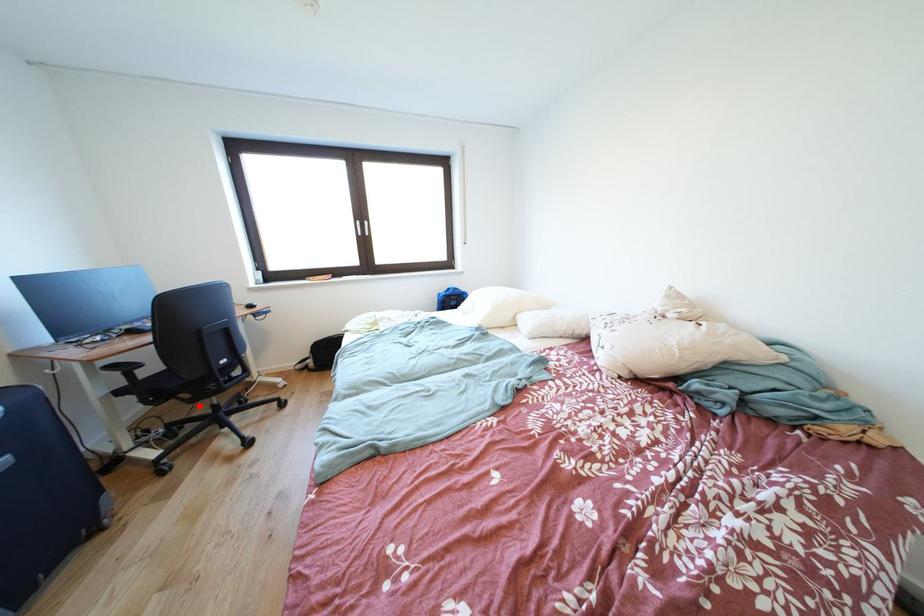
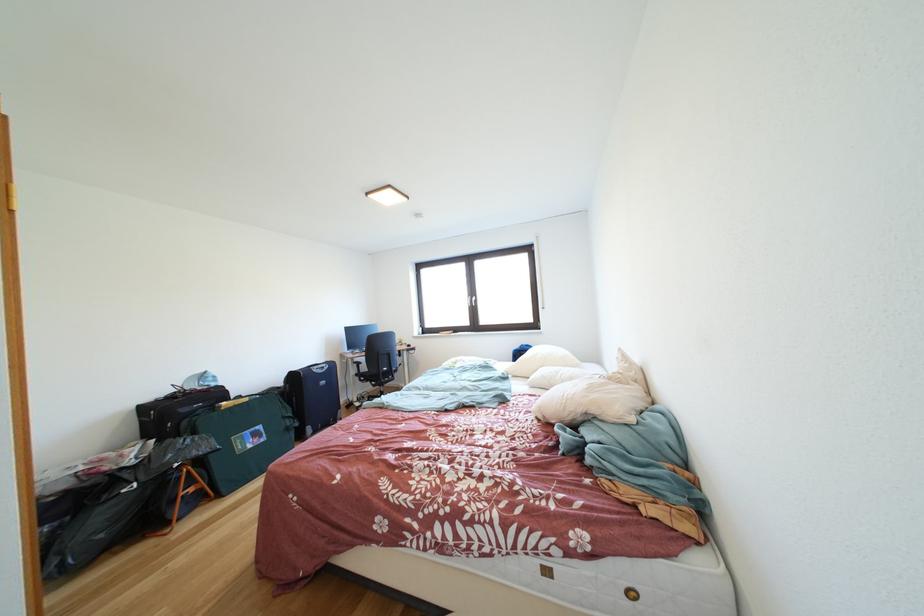
The point at the highlighted location is marked in the first image. Where is the corresponding point in the second image?

(383, 391)